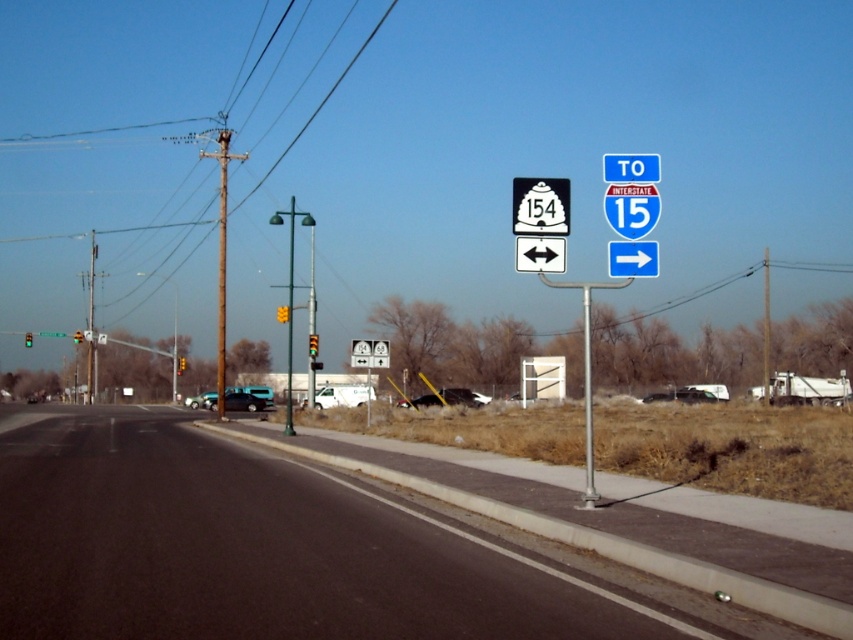
How far apart are yellow plastic traffic light at center and green glass traffic light at left?

They are 19.66 meters apart.

Can you confirm if yellow plastic traffic light at center is smaller than green glass traffic light at left?

Indeed, yellow plastic traffic light at center has a smaller size compared to green glass traffic light at left.

You are a GUI agent. You are given a task and a screenshot of the screen. Output one action in this format:
    pyautogui.click(x=<x>, y=<y>)
    Task: Click on the yellow plastic traffic light at center
    
    Given the screenshot: What is the action you would take?
    pyautogui.click(x=181, y=364)

The width and height of the screenshot is (853, 640). In order to click on yellow plastic traffic light at center in this screenshot , I will do `click(181, 364)`.

Is metallic silver sedan at lower left positioned behind green reflective traffic light at left?

No, it is not.

Is metallic silver sedan at lower left shorter than green reflective traffic light at left?

No.

What do you see at coordinates (201, 401) in the screenshot?
I see `metallic silver sedan at lower left` at bounding box center [201, 401].

I want to click on metallic silver sedan at lower left, so click(201, 401).

Looking at this image, between black matte car at center and teal glossy van at lower left, which one is positioned lower?

teal glossy van at lower left is lower down.

This screenshot has height=640, width=853. Find the location of `black matte car at center`. black matte car at center is located at coordinates (447, 397).

Where is `black matte car at center`? This screenshot has height=640, width=853. black matte car at center is located at coordinates (447, 397).